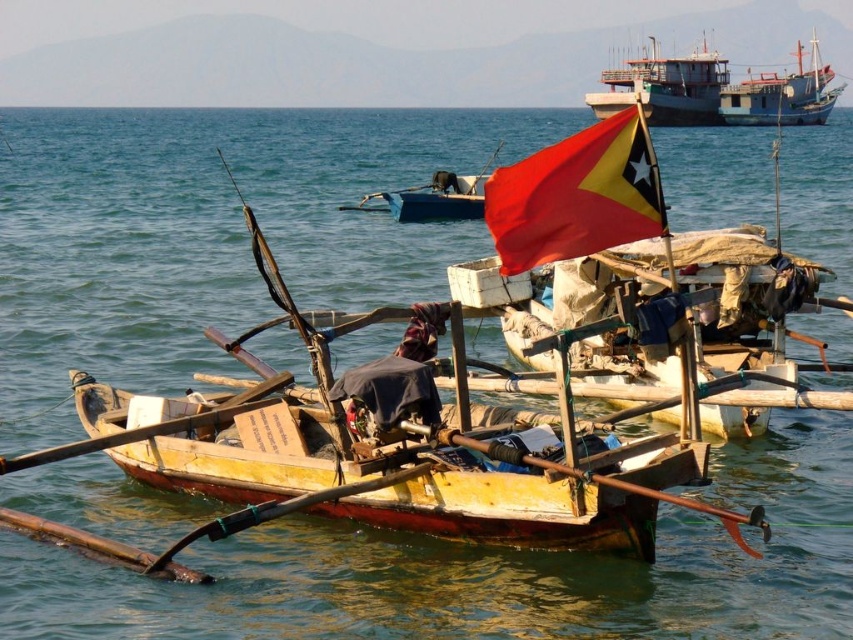
Is metallic gray ship at upper center to the left of wooden paddle at lower left from the viewer's perspective?

No, metallic gray ship at upper center is not to the left of wooden paddle at lower left.

Which is in front, point (701, 84) or point (6, 467)?

Point (6, 467)

You are a GUI agent. You are given a task and a screenshot of the screen. Output one action in this format:
    pyautogui.click(x=<x>, y=<y>)
    Task: Click on the metallic gray ship at upper center
    The image size is (853, 640).
    Given the screenshot: What is the action you would take?
    pyautogui.click(x=665, y=88)

Locate an element on the screen. Image resolution: width=853 pixels, height=640 pixels. metallic gray ship at upper center is located at coordinates (665, 88).

Is wooden boat at center closer to camera compared to wooden paddle at lower left?

That is True.

Locate an element on the screen. Image resolution: width=853 pixels, height=640 pixels. wooden boat at center is located at coordinates (741, 296).

Who is shorter, metallic gray ship at upper center or wooden fishing boat at upper right?

wooden fishing boat at upper right is shorter.

Looking at this image, can you confirm if metallic gray ship at upper center is wider than wooden fishing boat at upper right?

Yes, metallic gray ship at upper center is wider than wooden fishing boat at upper right.

Find the location of a particular element. metallic gray ship at upper center is located at coordinates (665, 88).

Image resolution: width=853 pixels, height=640 pixels. What are the coordinates of `metallic gray ship at upper center` in the screenshot? It's located at click(665, 88).